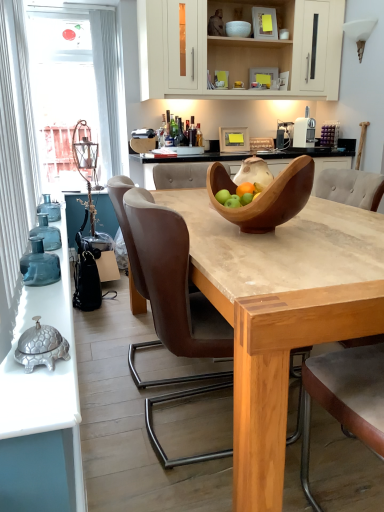
Question: Which direction should I rotate to look at wooden bowl at center, which is the 1th bowl in front-to-back order?

Choices:
 (A) right
 (B) left

Answer: (A)

Question: From a real-world perspective, is white glossy bowl at upper center, which appears as the first bowl when viewed from the back, positioned under light brown leather armchair at center based on gravity?

Choices:
 (A) no
 (B) yes

Answer: (A)

Question: From a real-world perspective, is white glossy bowl at upper center, which is the 2th bowl in bottom-to-top order, located higher than light brown leather armchair at center?

Choices:
 (A) no
 (B) yes

Answer: (B)

Question: From the image's perspective, is white glossy bowl at upper center, which is the 2th bowl in bottom-to-top order, located beneath light brown leather armchair at center?

Choices:
 (A) no
 (B) yes

Answer: (A)

Question: Does white glossy bowl at upper center, which is the 2th bowl in bottom-to-top order, have a lesser height compared to light brown leather armchair at center?

Choices:
 (A) no
 (B) yes

Answer: (B)

Question: Is white glossy bowl at upper center, which appears as the first bowl when viewed from the back, not within light brown leather armchair at center?

Choices:
 (A) yes
 (B) no

Answer: (A)

Question: Does white glossy bowl at upper center, acting as the 1th bowl starting from the top, have a greater height compared to light brown leather armchair at center?

Choices:
 (A) yes
 (B) no

Answer: (B)

Question: Does translucent glass bottles at left appear on the right side of light brown leather armchair at center?

Choices:
 (A) no
 (B) yes

Answer: (A)

Question: Is translucent glass bottles at left taller than light brown leather armchair at center?

Choices:
 (A) yes
 (B) no

Answer: (B)

Question: Is translucent glass bottles at left turned away from light brown leather armchair at center?

Choices:
 (A) yes
 (B) no

Answer: (B)

Question: Would you say translucent glass bottles at left is outside light brown leather armchair at center?

Choices:
 (A) no
 (B) yes

Answer: (B)

Question: From a real-world perspective, is translucent glass bottles at left located beneath light brown leather armchair at center?

Choices:
 (A) no
 (B) yes

Answer: (A)

Question: Does translucent glass bottles at left appear on the left side of light brown leather armchair at center?

Choices:
 (A) yes
 (B) no

Answer: (A)

Question: From the image's perspective, is light brown leather armchair at center located above translucent glass bottles at left?

Choices:
 (A) no
 (B) yes

Answer: (A)